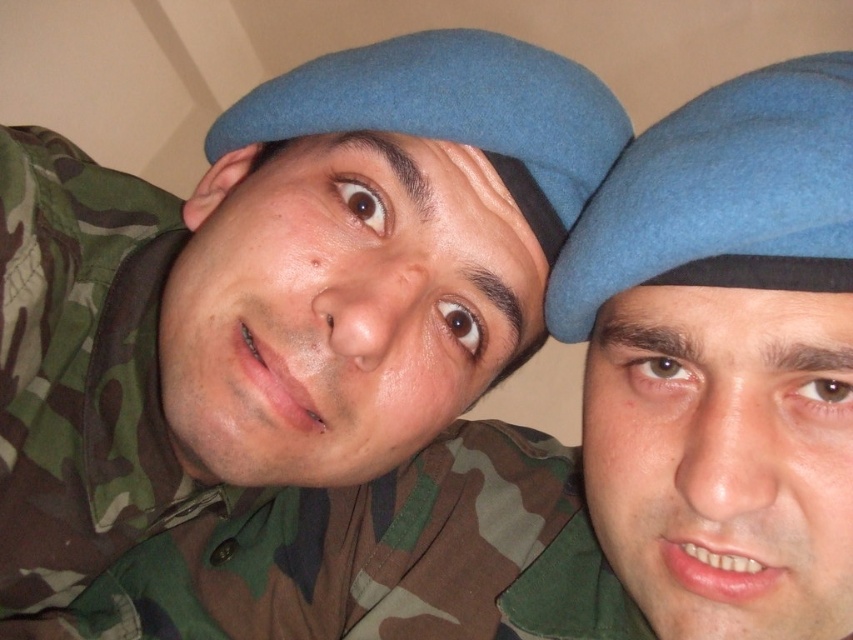
You are a tailor measuring berets for a military parade. You have two berets to compare. The first is the blue felt beret at center and the second is the blue felt beret at upper right. Which beret would you choose for a soldier who needs a taller beret?

The blue felt beret at center is much taller than the blue felt beret at upper right, so you should choose the blue felt beret at center for the soldier who needs a taller beret.

You are a military inspector checking the uniform details of two soldiers. You notice the blue felt beret at upper right and the matte blue beret at center. Which beret is located below the other?

The blue felt beret at upper right is positioned under the matte blue beret at center, so the blue felt beret at upper right is below the matte blue beret at center.

You are a photographer adjusting your camera settings to capture the blue felt beret at center. The camera has a focus point at point (723, 356). Will this focus point land on the blue felt beret at center?

Yes, the focus point at (723, 356) will land on the blue felt beret at center because the point is described as being on the blue felt beret at center.